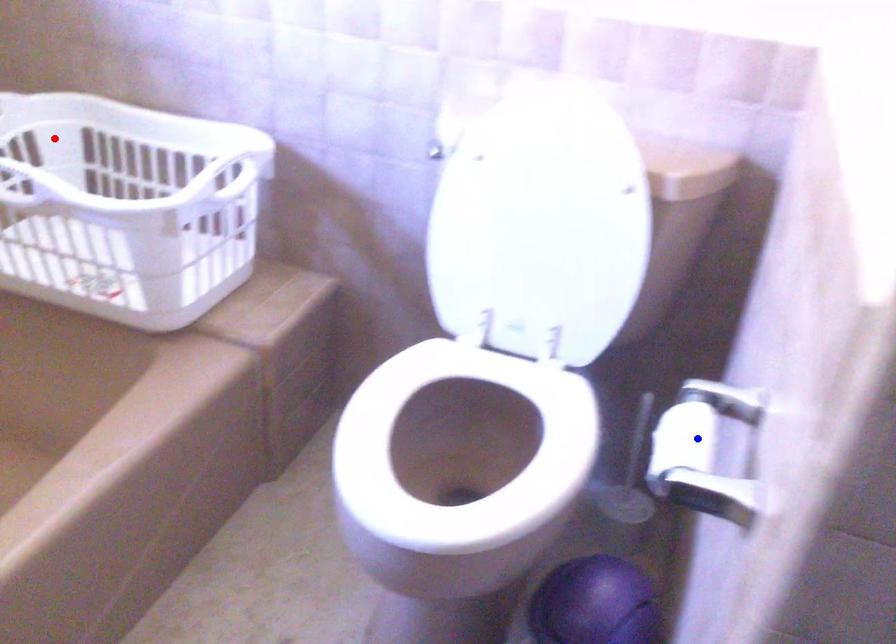
Question: Which of the two points in the image is closer to the camera?

Choices:
 (A) Blue point is closer.
 (B) Red point is closer.

Answer: (A)